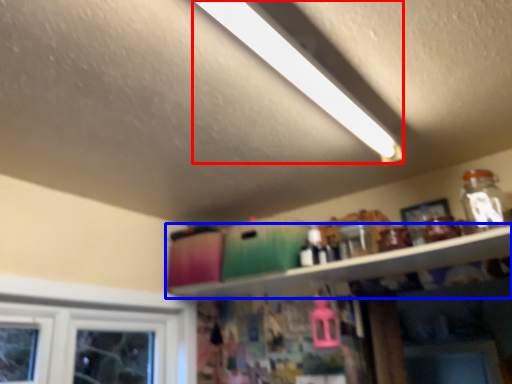
Question: Which object is closer to the camera taking this photo, light (highlighted by a red box) or shelf (highlighted by a blue box)?

Choices:
 (A) light
 (B) shelf

Answer: (A)